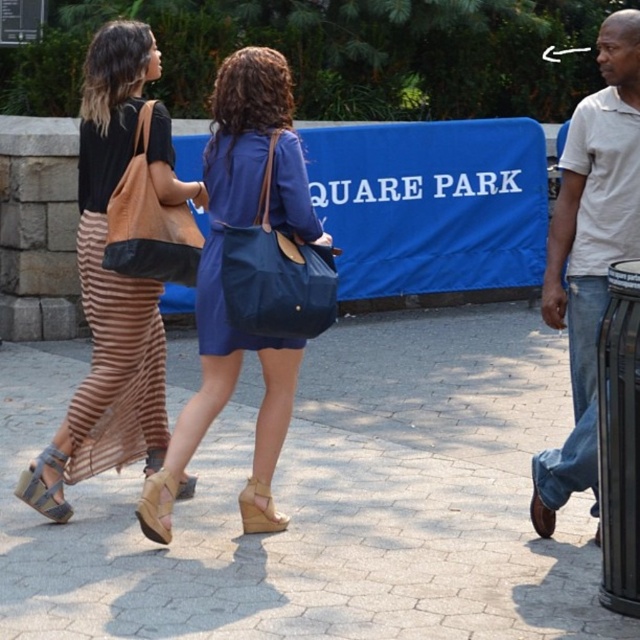
Question: Can you confirm if matte brown skirt at left is positioned above white cotton shirt at right?

Choices:
 (A) yes
 (B) no

Answer: (A)

Question: Estimate the real-world distances between objects in this image. Which object is closer to the brown brick pavement at center?

Choices:
 (A) leather tote at left
 (B) matte brown skirt at left
 (C) blue fabric bag at center
 (D) matte blue dress at center

Answer: (D)

Question: Does matte brown skirt at left have a greater width compared to blue fabric bag at center?

Choices:
 (A) no
 (B) yes

Answer: (B)

Question: Which object appears farthest from the camera in this image?

Choices:
 (A) leather tote at left
 (B) matte blue dress at center

Answer: (A)

Question: Does brown brick pavement at center come in front of matte blue dress at center?

Choices:
 (A) no
 (B) yes

Answer: (B)

Question: Which of the following is the closest to the observer?

Choices:
 (A) leather tote at left
 (B) matte brown skirt at left

Answer: (A)